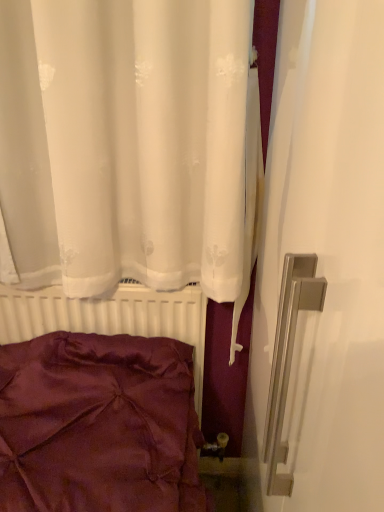
Question: Should I look upward or downward to see white matte radiator at lower left?

Choices:
 (A) down
 (B) up

Answer: (A)

Question: Would you say satin burgundy pillow at lower left is a long distance from white matte radiator at lower left?

Choices:
 (A) yes
 (B) no

Answer: (B)

Question: From a real-world perspective, is satin burgundy pillow at lower left physically below white matte radiator at lower left?

Choices:
 (A) no
 (B) yes

Answer: (A)

Question: Is satin burgundy pillow at lower left at the right side of white matte radiator at lower left?

Choices:
 (A) yes
 (B) no

Answer: (B)

Question: From the image's perspective, is satin burgundy pillow at lower left below white matte radiator at lower left?

Choices:
 (A) no
 (B) yes

Answer: (A)

Question: Can you confirm if satin burgundy pillow at lower left is shorter than white matte radiator at lower left?

Choices:
 (A) no
 (B) yes

Answer: (B)

Question: Considering the relative sizes of satin burgundy pillow at lower left and white matte radiator at lower left in the image provided, is satin burgundy pillow at lower left wider than white matte radiator at lower left?

Choices:
 (A) no
 (B) yes

Answer: (B)

Question: Is white matte radiator at lower left turned away from satin burgundy pillow at lower left?

Choices:
 (A) no
 (B) yes

Answer: (B)

Question: Can you confirm if white matte radiator at lower left is smaller than satin burgundy pillow at lower left?

Choices:
 (A) yes
 (B) no

Answer: (A)

Question: From the image's perspective, is white matte radiator at lower left under satin burgundy pillow at lower left?

Choices:
 (A) yes
 (B) no

Answer: (A)

Question: Could you tell me if white matte radiator at lower left is facing satin burgundy pillow at lower left?

Choices:
 (A) yes
 (B) no

Answer: (A)

Question: Is white matte radiator at lower left placed right next to satin burgundy pillow at lower left?

Choices:
 (A) yes
 (B) no

Answer: (B)

Question: Is white matte radiator at lower left positioned in front of satin burgundy pillow at lower left?

Choices:
 (A) yes
 (B) no

Answer: (B)

Question: Based on their sizes in the image, would you say satin burgundy pillow at lower left is bigger or smaller than white matte radiator at lower left?

Choices:
 (A) big
 (B) small

Answer: (A)